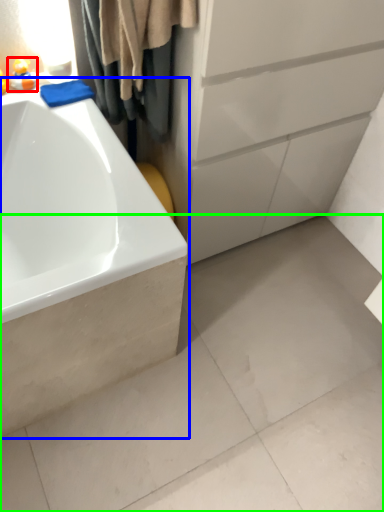
Question: Based on their relative distances, which object is farther from toy (highlighted by a red box)? Choose from bathtub (highlighted by a blue box) and concrete (highlighted by a green box).

Choices:
 (A) bathtub
 (B) concrete

Answer: (B)